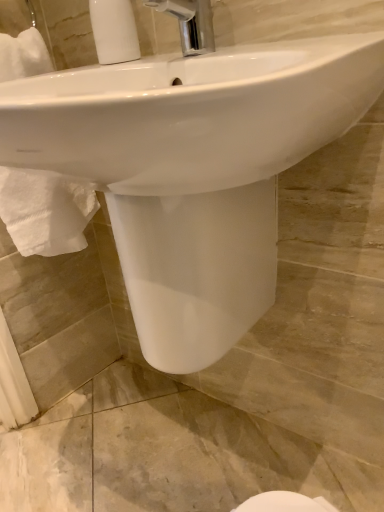
Question: Can you confirm if chrome metallic faucet at upper center is positioned to the right of white ribbed plastic at upper left?

Choices:
 (A) no
 (B) yes

Answer: (B)

Question: From the image's perspective, is chrome metallic faucet at upper center over white ribbed plastic at upper left?

Choices:
 (A) yes
 (B) no

Answer: (B)

Question: Does chrome metallic faucet at upper center lie in front of white ribbed plastic at upper left?

Choices:
 (A) no
 (B) yes

Answer: (B)

Question: Is chrome metallic faucet at upper center placed right next to white ribbed plastic at upper left?

Choices:
 (A) no
 (B) yes

Answer: (B)

Question: Considering the relative positions of chrome metallic faucet at upper center and white ribbed plastic at upper left in the image provided, is chrome metallic faucet at upper center to the left of white ribbed plastic at upper left from the viewer's perspective?

Choices:
 (A) no
 (B) yes

Answer: (A)

Question: From their relative heights in the image, would you say white glossy sink at center is taller or shorter than chrome metallic faucet at upper center?

Choices:
 (A) tall
 (B) short

Answer: (A)

Question: From a real-world perspective, is white glossy sink at center physically located above or below chrome metallic faucet at upper center?

Choices:
 (A) above
 (B) below

Answer: (B)

Question: Based on their sizes in the image, would you say white glossy sink at center is bigger or smaller than chrome metallic faucet at upper center?

Choices:
 (A) big
 (B) small

Answer: (A)

Question: Does point (170, 351) appear closer or farther from the camera than point (183, 19)?

Choices:
 (A) closer
 (B) farther

Answer: (B)

Question: Considering the positions of point (211, 28) and point (125, 59), is point (211, 28) closer or farther from the camera than point (125, 59)?

Choices:
 (A) farther
 (B) closer

Answer: (B)

Question: Choose the correct answer: Is chrome metallic faucet at upper center inside white ribbed plastic at upper left or outside it?

Choices:
 (A) inside
 (B) outside

Answer: (B)

Question: From a real-world perspective, relative to white ribbed plastic at upper left, is chrome metallic faucet at upper center vertically above or below?

Choices:
 (A) above
 (B) below

Answer: (B)

Question: Considering the positions of chrome metallic faucet at upper center and white ribbed plastic at upper left in the image, is chrome metallic faucet at upper center wider or thinner than white ribbed plastic at upper left?

Choices:
 (A) thin
 (B) wide

Answer: (B)

Question: From a real-world perspective, relative to chrome metallic faucet at upper center, is white ribbed plastic at upper left vertically above or below?

Choices:
 (A) below
 (B) above

Answer: (B)

Question: From the image's perspective, is white ribbed plastic at upper left above or below chrome metallic faucet at upper center?

Choices:
 (A) below
 (B) above

Answer: (B)